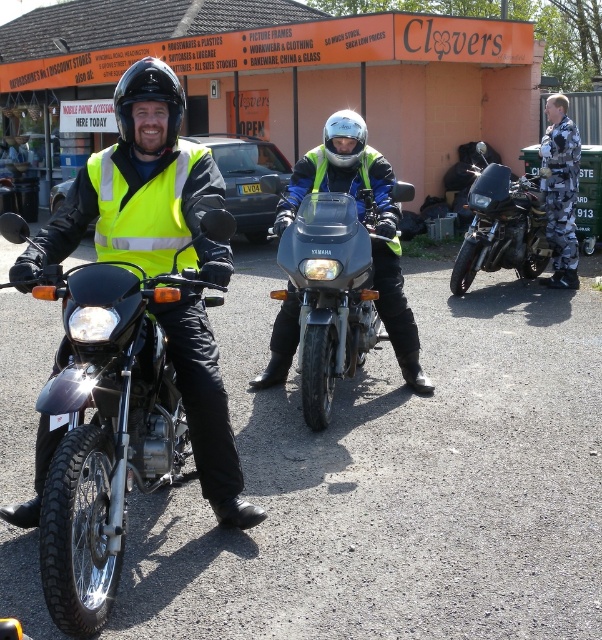
Who is taller, matte black motorcycle at center or glossy white helmet at center?

Standing taller between the two is matte black motorcycle at center.

Which is below, matte black motorcycle at center or glossy white helmet at center?

matte black motorcycle at center

Who is more forward, (317, 400) or (341, 125)?

Positioned in front is point (317, 400).

Image resolution: width=602 pixels, height=640 pixels. I want to click on matte black motorcycle at center, so click(x=330, y=292).

Does matte black motorcycle at left have a larger size compared to yellow reflective safety vest at left?

Indeed, matte black motorcycle at left has a larger size compared to yellow reflective safety vest at left.

Between matte black motorcycle at left and yellow reflective safety vest at left, which one has less height?

yellow reflective safety vest at left

Identify the location of matte black motorcycle at left. The height and width of the screenshot is (640, 602). (104, 429).

Is matte black motorcycle at center in front of shiny black motorcycle at right?

That is True.

This screenshot has height=640, width=602. I want to click on matte black motorcycle at center, so click(330, 292).